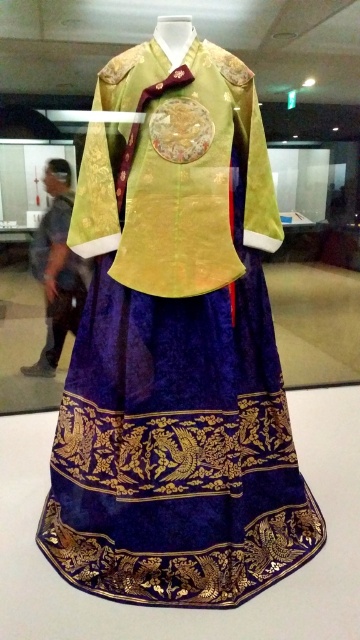
You are a photographer standing in front of the velvet gold brocade dress at center. You want to take a photo that captures the entire dress without any distortion. The camera you are using has a minimum focusing distance of 1.2 meters. Can you take the photo from your current position?

The distance between the velvet gold brocade dress at center and the camera is 1.30 meters, which is greater than the camera minimum focusing distance of 1.2 meters. Therefore, you can take the photo from your current position.

You are a fashion designer who wants to display two dresses on a single mannequin. The velvet gold brocade dress at center and the velvet fabric dress at center are both available. Given their widths, which dress should you choose to ensure it fits properly on the mannequin?

The velvet gold brocade dress at center is wider than the velvet fabric dress at center. Therefore, the velvet fabric dress at center would fit better on the mannequin since it has a narrower width.